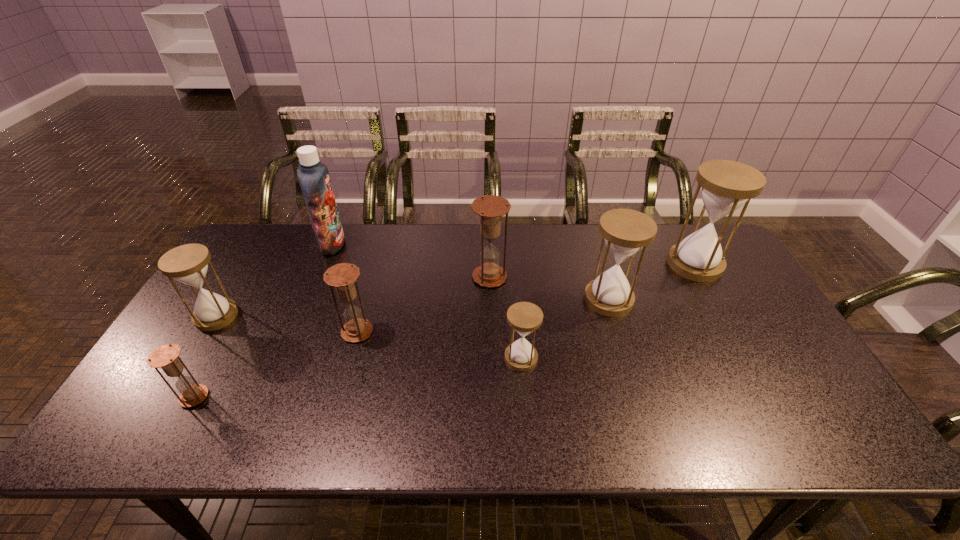
The width and height of the screenshot is (960, 540). I want to click on the sixth object from right to left, so click(x=313, y=176).

The image size is (960, 540). Find the location of `blue shampoo`. blue shampoo is located at coordinates (313, 176).

Identify the location of the tallest hourglass. Image resolution: width=960 pixels, height=540 pixels. (726, 185).

Where is `the biggest white hourglass`? the biggest white hourglass is located at coordinates (726, 185).

You are a GUI agent. You are given a task and a screenshot of the screen. Output one action in this format:
    pyautogui.click(x=<x>, y=<y>)
    Task: Click on the biggest brown hourglass
    This screenshot has width=960, height=540.
    Given the screenshot: What is the action you would take?
    pyautogui.click(x=490, y=208)

The height and width of the screenshot is (540, 960). Find the location of `the farthest brown hourglass`. the farthest brown hourglass is located at coordinates (490, 208).

This screenshot has width=960, height=540. What are the coordinates of `the seventh object from left to right` in the screenshot? It's located at (625, 232).

Where is `the second biggest white hourglass`? This screenshot has height=540, width=960. the second biggest white hourglass is located at coordinates (625, 232).

Where is `the fourth object from left to right`? the fourth object from left to right is located at coordinates (342, 276).

I want to click on the second brown hourglass from right to left, so click(x=342, y=276).